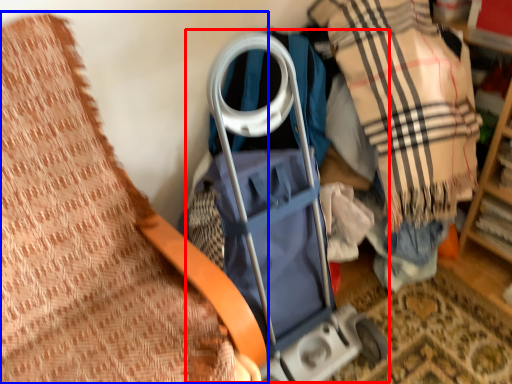
Question: Which object appears closest to the camera in this image, baby carriage (highlighted by a red box) or furniture (highlighted by a blue box)?

Choices:
 (A) baby carriage
 (B) furniture

Answer: (B)